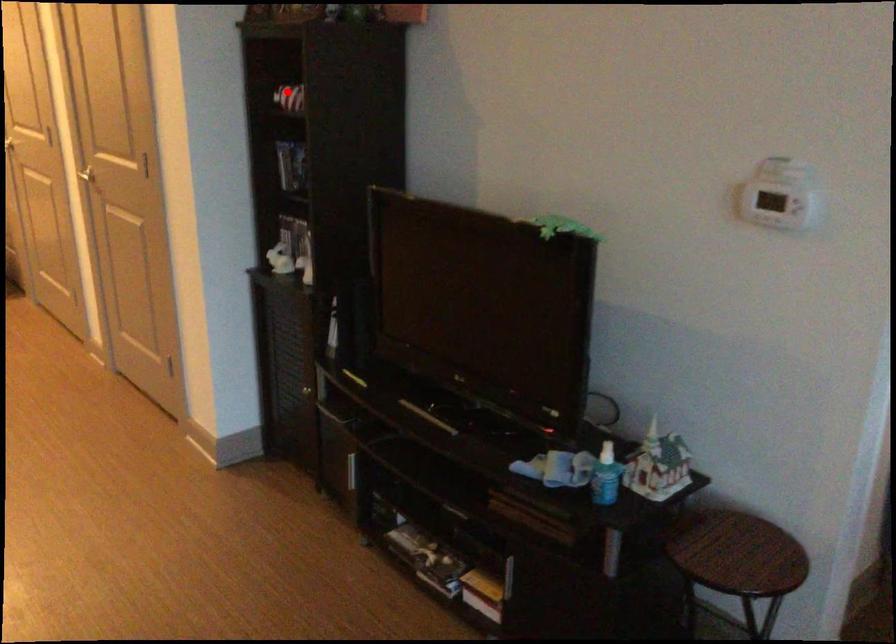
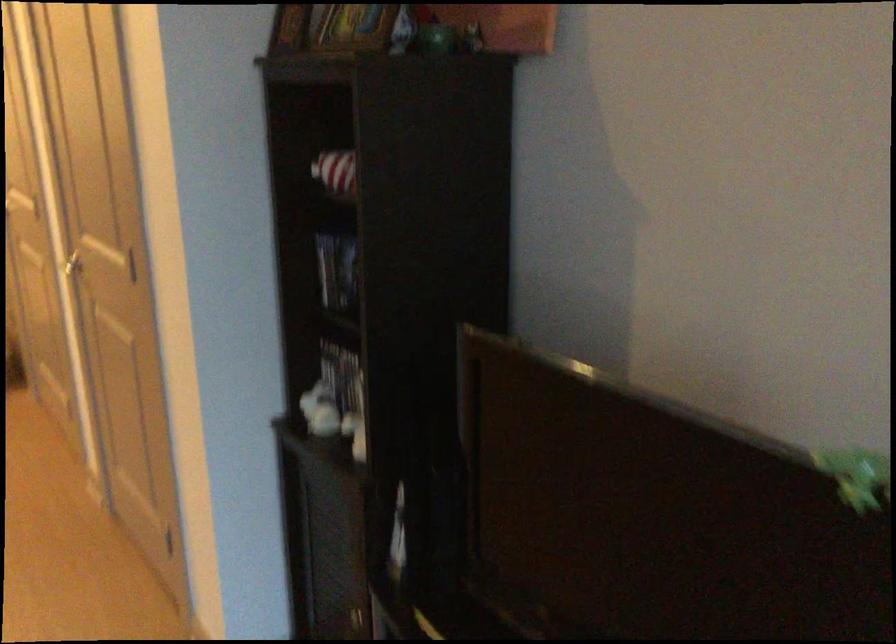
Question: I am providing you with two images of the same scene from different viewpoints. Image1 has a red point marked. In image2, the corresponding 3D location appears at what relative position? Reply with the corresponding letter.

Choices:
 (A) Closer
 (B) Farther

Answer: (A)